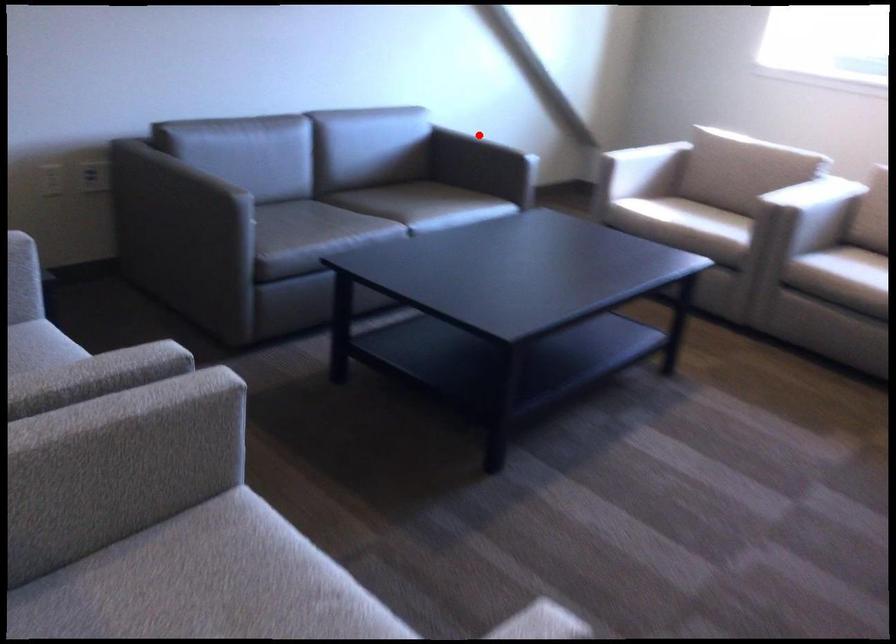
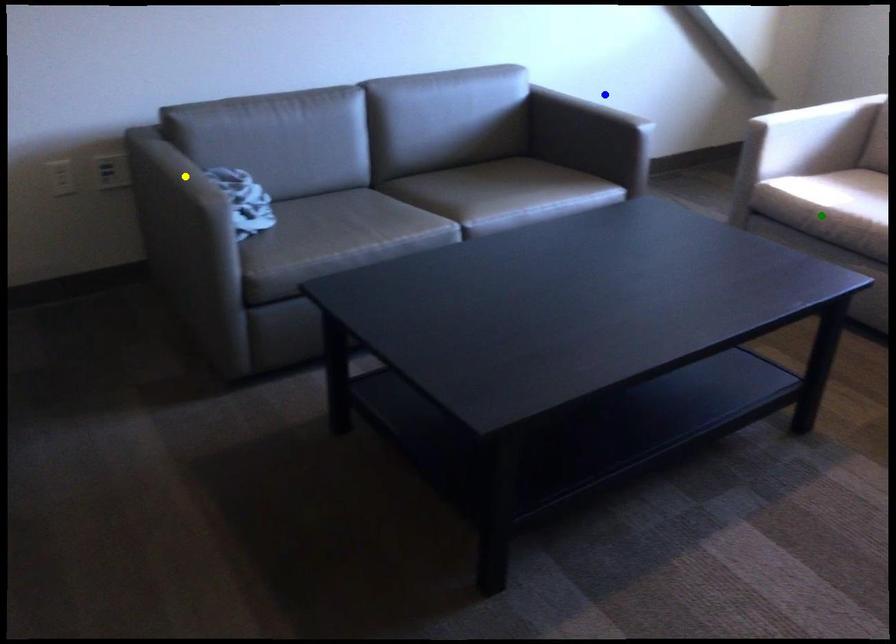
Question: I am providing you with two images of the same scene from different viewpoints. A red point is marked on the first image. You are given multiple points on the second image. Which spot in image 2 lines up with the point in image 1?

Choices:
 (A) blue point
 (B) green point
 (C) yellow point

Answer: (A)